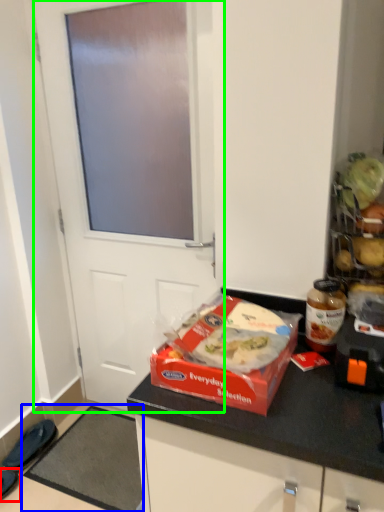
Question: Which object is positioned closest to footwear (highlighted by a red box)? Select from doormat (highlighted by a blue box) and door (highlighted by a green box).

Choices:
 (A) doormat
 (B) door

Answer: (A)